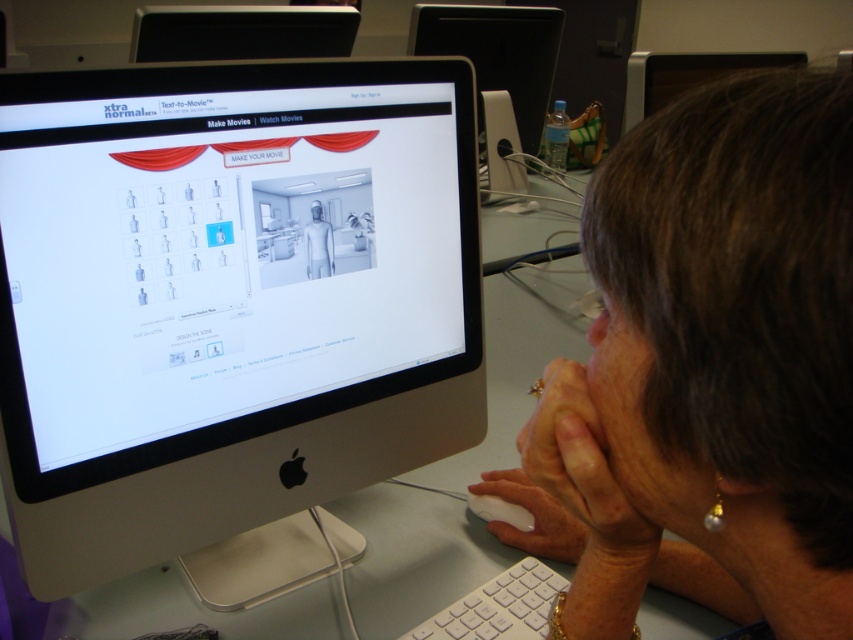
Can you confirm if smooth skin face at center is taller than black glossy computer monitor at upper center?

Yes.

Can you confirm if smooth skin face at center is positioned to the right of black glossy computer monitor at upper center?

Yes, smooth skin face at center is to the right of black glossy computer monitor at upper center.

Which is in front, point (755, 364) or point (310, 1)?

Positioned in front is point (755, 364).

Where is `smooth skin face at center`? smooth skin face at center is located at coordinates click(x=714, y=364).

The width and height of the screenshot is (853, 640). Describe the element at coordinates (242, 32) in the screenshot. I see `black glossy computer monitor at upper center` at that location.

Which is below, black glossy computer monitor at upper center or white glossy mouse at lower center?

Positioned lower is white glossy mouse at lower center.

Where is `black glossy computer monitor at upper center`? black glossy computer monitor at upper center is located at coordinates (242, 32).

The height and width of the screenshot is (640, 853). I want to click on black glossy computer monitor at upper center, so click(x=242, y=32).

Is smooth skin face at center smaller than white matte mannequin at center?

No.

This screenshot has height=640, width=853. What do you see at coordinates (714, 364) in the screenshot?
I see `smooth skin face at center` at bounding box center [714, 364].

This screenshot has width=853, height=640. Find the location of `smooth skin face at center`. smooth skin face at center is located at coordinates (714, 364).